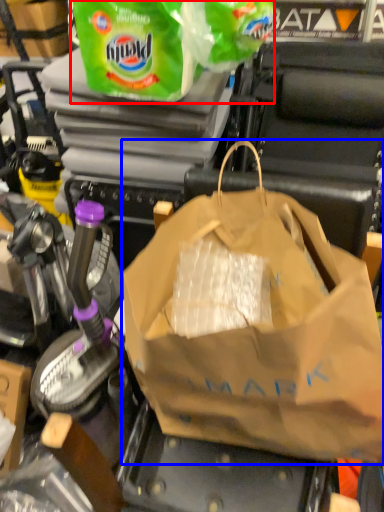
Question: Which point is further to the camera, plastic bag (highlighted by a red box) or plastic bag (highlighted by a blue box)?

Choices:
 (A) plastic bag
 (B) plastic bag

Answer: (A)